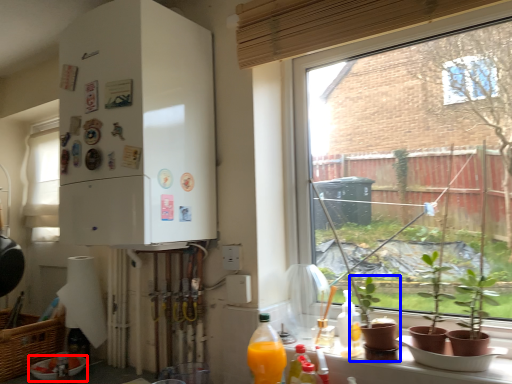
Question: Which of the following is the farthest to the observer, bowl (highlighted by a red box) or houseplant (highlighted by a blue box)?

Choices:
 (A) bowl
 (B) houseplant

Answer: (A)